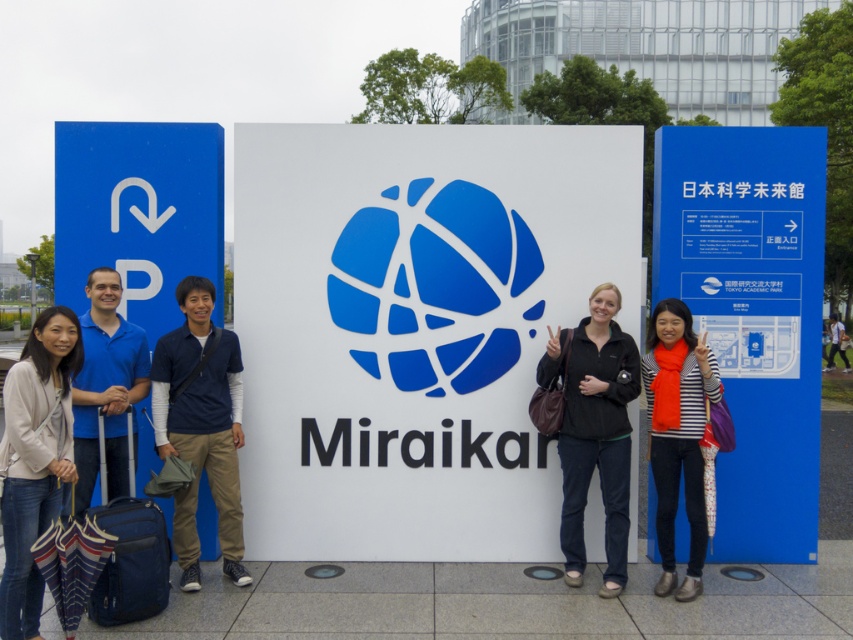
You are a tourist trying to locate the parking area. You see the blue plastic sign at left and the blue cotton shirt at center. Which object is bigger and could help you navigate better from a distance?

The blue plastic sign at left is larger in size than the blue cotton shirt at center, so it would be easier to see from a distance and help you navigate to the parking area.

You are a visitor at the Miraikan signboard and see the blue plastic sign at left and the blue fabric shirt at center. Which object is located to the right of the other?

The blue plastic sign at left is positioned on the right side of blue fabric shirt at center, so the blue plastic sign at left is to the right of the blue fabric shirt at center.

Based on the photo, you are a visitor at the Miraikan signboard and want to check the height of the blue plastic sign at right compared to the light beige sweater at center. Which one is taller?

The blue plastic sign at right is much taller than the light beige sweater at center.